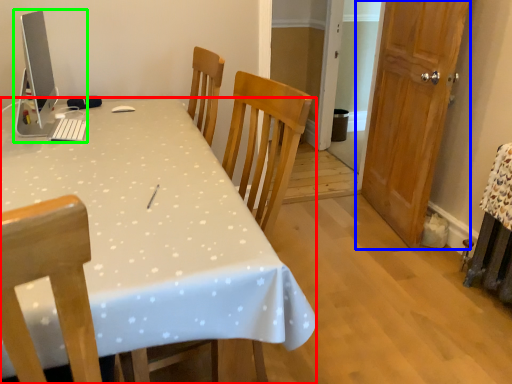
Question: Based on their relative distances, which object is farther from desk (highlighted by a red box)? Choose from door (highlighted by a blue box) and desktop computer (highlighted by a green box).

Choices:
 (A) door
 (B) desktop computer

Answer: (A)